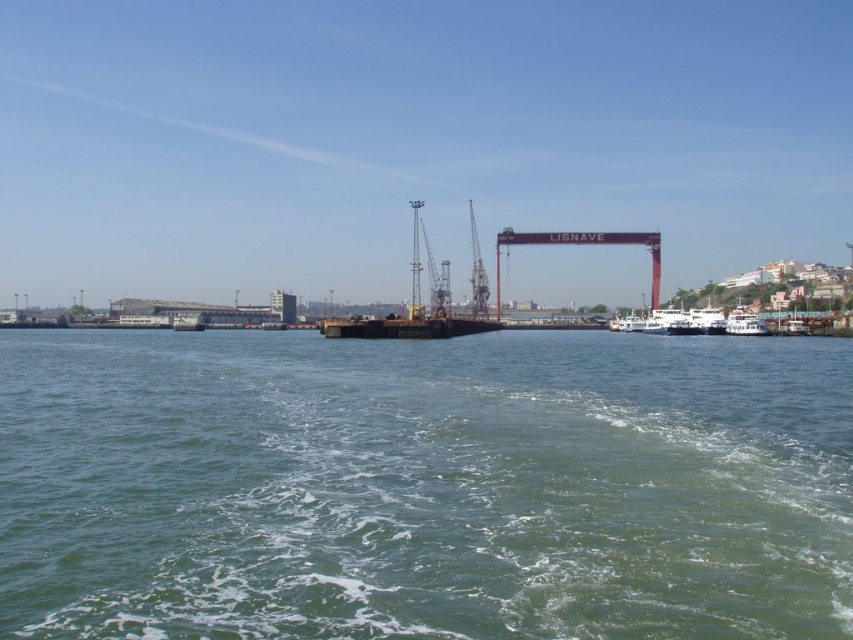
Is green water at center taller than metallic industrial crane at center?

Incorrect, green water at center's height is not larger of metallic industrial crane at center's.

Is point (674, 525) positioned after point (482, 272)?

No, (674, 525) is in front of (482, 272).

The height and width of the screenshot is (640, 853). In order to click on green water at center in this screenshot , I will do coord(424,486).